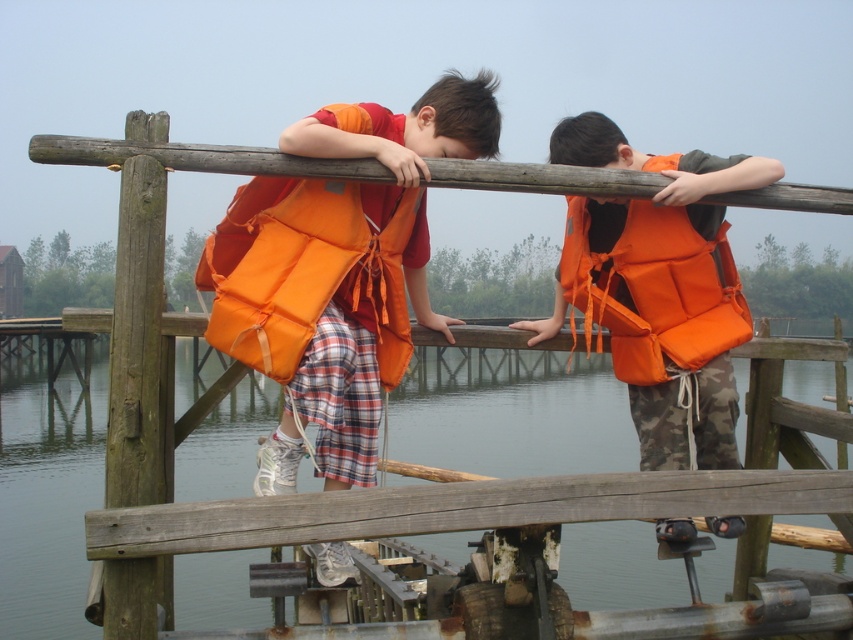
You are a lifeguard on duty and notice two children on a wooden dock. You see an orange matte life jacket at upper center located at point (311, 268). Is the life jacket closer to the child on the left or the child on the right?

The orange matte life jacket at upper center is located at point (311, 268). Since the children are positioned on the left and right sides of the dock, the life jacket is centrally placed between them, so it is equidistant from both children.

You are a drone operator trying to capture aerial footage of the two children on the dock. You need to position your drone so that it flies directly between the two points marked as point (595,476) and point (299,348). From the perspective of someone standing on the dock, which point should the drone fly towards first to ensure it passes between them?

The drone should fly towards point (595,476) first because it is in front of point (299,348), so flying towards it first will allow the drone to pass between the two points.

You are a photographer trying to capture the orange matte life jacket at upper center in the image. Based on its 2D coordinates, where would you position your camera to ensure it is centered in the frame?

To center the orange matte life jacket at upper center in the frame, position your camera so that the crosshairs align with the coordinates 0.420 on the x axis and 0.366 on the y axis.